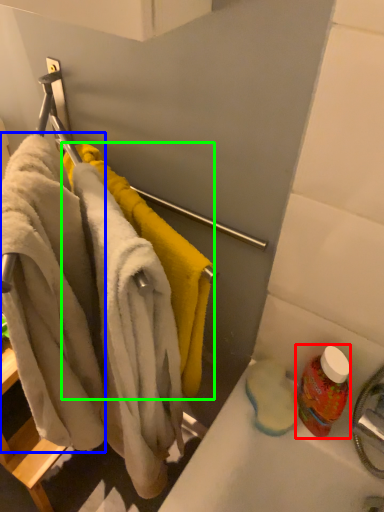
Question: Which is farther away from cleaning product (highlighted by a red box)? bath towel (highlighted by a blue box) or towel (highlighted by a green box)?

Choices:
 (A) bath towel
 (B) towel

Answer: (A)